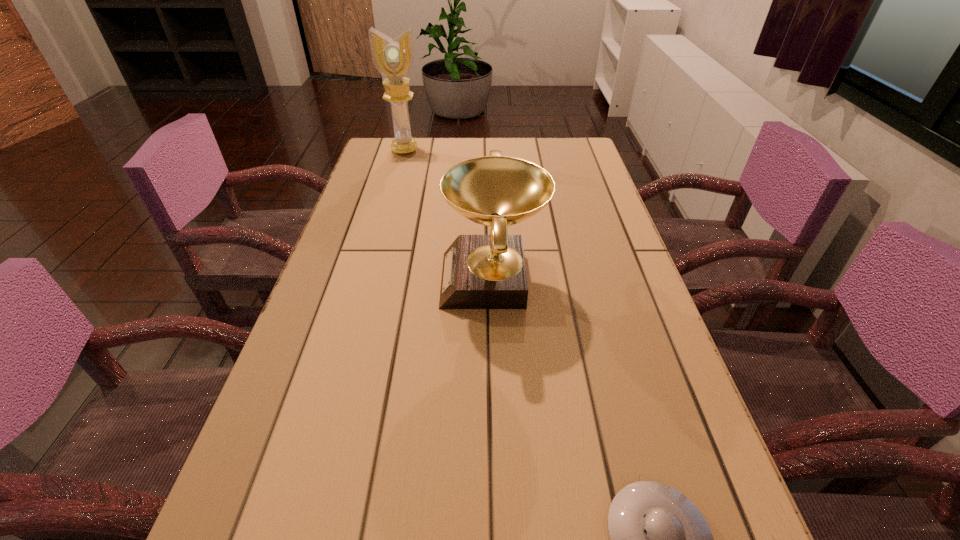
The width and height of the screenshot is (960, 540). What are the coordinates of `the tallest object` in the screenshot? It's located at (393, 58).

This screenshot has width=960, height=540. Find the location of `the farthest object`. the farthest object is located at coordinates (393, 58).

Identify the location of the shorter award. (479, 271).

This screenshot has height=540, width=960. I want to click on the nearer award, so click(479, 271).

The image size is (960, 540). In order to click on blank space located 0.210m on the front-facing side of the leftmost object in this screenshot , I will do `click(394, 190)`.

You are a GUI agent. You are given a task and a screenshot of the screen. Output one action in this format:
    pyautogui.click(x=<x>, y=<y>)
    Task: Click on the vacant space situated 0.080m on the front-facing side of the second farthest object
    
    Given the screenshot: What is the action you would take?
    pyautogui.click(x=406, y=280)

Locate an element on the screen. This screenshot has width=960, height=540. blank area located on the front-facing side of the second farthest object is located at coordinates (380, 280).

You are a GUI agent. You are given a task and a screenshot of the screen. Output one action in this format:
    pyautogui.click(x=<x>, y=<y>)
    Task: Click on the vacant position located on the front-facing side of the second farthest object
    
    Given the screenshot: What is the action you would take?
    pyautogui.click(x=376, y=280)

I want to click on object located in the far edge section of the desktop, so click(393, 58).

Locate an element on the screen. This screenshot has width=960, height=540. object that is at the left edge is located at coordinates (393, 58).